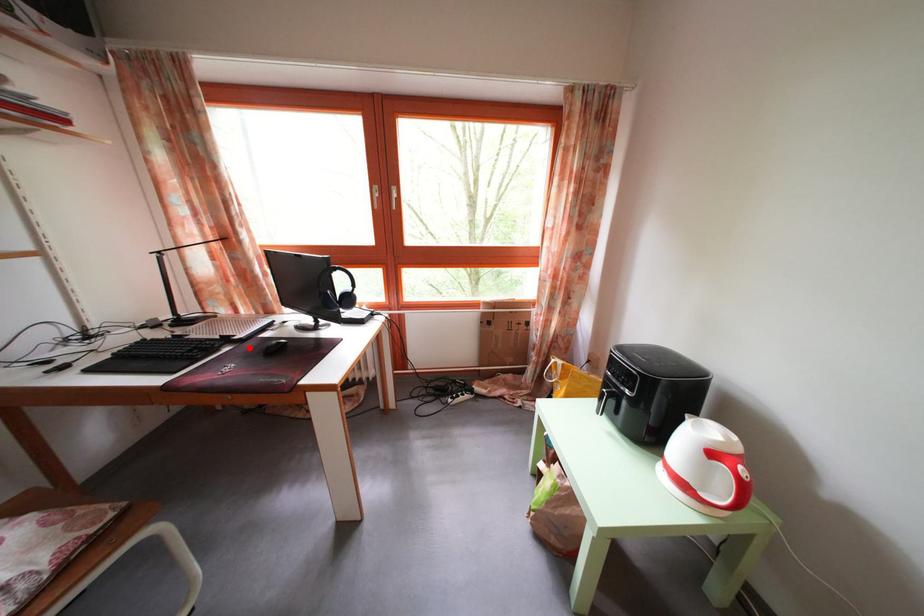
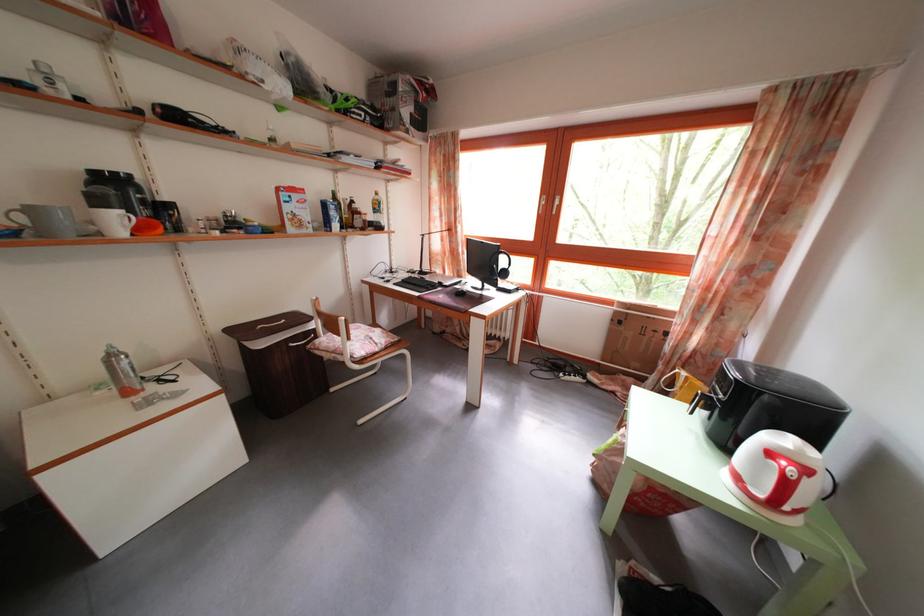
The point at the highlighted location is marked in the first image. Where is the corresponding point in the second image?

(454, 294)